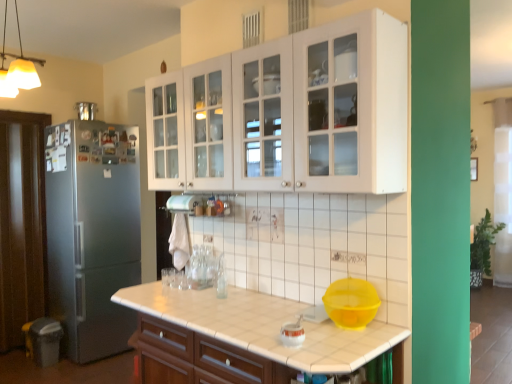
Question: Should I look upward or downward to see yellow plastic mixing bowl at lower center?

Choices:
 (A) up
 (B) down

Answer: (B)

Question: Is satin silver refrigerator at left facing towards white glossy cabinet at upper center, which is the 1th cabinetry in top-to-bottom order?

Choices:
 (A) no
 (B) yes

Answer: (B)

Question: Does satin silver refrigerator at left have a greater height compared to white glossy cabinet at upper center, arranged as the 2th cabinetry when ordered from the bottom?

Choices:
 (A) yes
 (B) no

Answer: (A)

Question: Can you confirm if satin silver refrigerator at left is smaller than white glossy cabinet at upper center, which is the 1th cabinetry in top-to-bottom order?

Choices:
 (A) no
 (B) yes

Answer: (A)

Question: Considering the relative sizes of satin silver refrigerator at left and white glossy cabinet at upper center, arranged as the 2th cabinetry when ordered from the bottom, in the image provided, is satin silver refrigerator at left wider than white glossy cabinet at upper center, arranged as the 2th cabinetry when ordered from the bottom,?

Choices:
 (A) no
 (B) yes

Answer: (B)

Question: Is satin silver refrigerator at left placed right next to white glossy cabinet at upper center, arranged as the 2th cabinetry when ordered from the bottom?

Choices:
 (A) no
 (B) yes

Answer: (A)

Question: Can you confirm if satin silver refrigerator at left is positioned to the left of white glossy cabinet at upper center, which is the 1th cabinetry in top-to-bottom order?

Choices:
 (A) no
 (B) yes

Answer: (B)

Question: Does matte white countertop at center, marked as the 1th cabinetry in a bottom-to-top arrangement, have a lesser width compared to yellow plastic mixing bowl at lower center?

Choices:
 (A) no
 (B) yes

Answer: (A)

Question: Is the position of matte white countertop at center, marked as the 1th cabinetry in a bottom-to-top arrangement, more distant than that of yellow plastic mixing bowl at lower center?

Choices:
 (A) yes
 (B) no

Answer: (B)

Question: From the image's perspective, does matte white countertop at center, the 2th cabinetry from the top, appear lower than yellow plastic mixing bowl at lower center?

Choices:
 (A) no
 (B) yes

Answer: (B)

Question: Is matte white countertop at center, marked as the 1th cabinetry in a bottom-to-top arrangement, positioned with its back to yellow plastic mixing bowl at lower center?

Choices:
 (A) no
 (B) yes

Answer: (A)

Question: Is matte white countertop at center, the 2th cabinetry from the top, positioned beyond the bounds of yellow plastic mixing bowl at lower center?

Choices:
 (A) yes
 (B) no

Answer: (A)

Question: From a real-world perspective, is matte white countertop at center, marked as the 1th cabinetry in a bottom-to-top arrangement, physically below yellow plastic mixing bowl at lower center?

Choices:
 (A) yes
 (B) no

Answer: (A)

Question: Is brushed metal refrigerator at left, placed as the first appliance when sorted from top to bottom, in contact with white glossy kettle at center, which appears as the first appliance when viewed from the front?

Choices:
 (A) yes
 (B) no

Answer: (B)